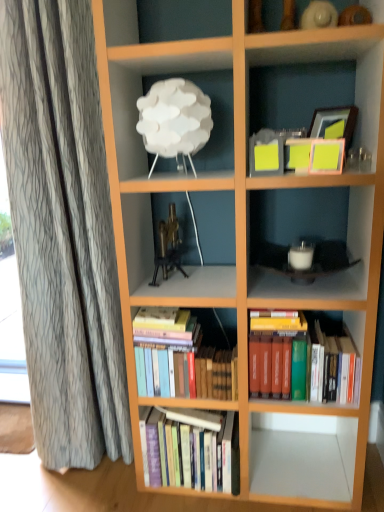
Question: Considering the relative positions of hardcover books at center, which is the third book in bottom-to-top order, and gold metallic tripod at center in the image provided, is hardcover books at center, which is the third book in bottom-to-top order, to the right of gold metallic tripod at center from the viewer's perspective?

Choices:
 (A) no
 (B) yes

Answer: (B)

Question: From a real-world perspective, is hardcover books at center, which is the third book in bottom-to-top order, physically below gold metallic tripod at center?

Choices:
 (A) yes
 (B) no

Answer: (A)

Question: Is hardcover books at center, which is the third book in bottom-to-top order, thinner than gold metallic tripod at center?

Choices:
 (A) yes
 (B) no

Answer: (B)

Question: Is hardcover books at center, which is counted as the first book, starting from the top, wider than gold metallic tripod at center?

Choices:
 (A) no
 (B) yes

Answer: (B)

Question: Is hardcover books at center, which is the third book in bottom-to-top order, taller than gold metallic tripod at center?

Choices:
 (A) no
 (B) yes

Answer: (B)

Question: Is the surface of hardcover books at center, which is the third book in bottom-to-top order, in direct contact with gold metallic tripod at center?

Choices:
 (A) yes
 (B) no

Answer: (B)

Question: Are wooden picture frame at upper right and hardcover books at center, which is the third book in bottom-to-top order, located far from each other?

Choices:
 (A) yes
 (B) no

Answer: (B)

Question: Does wooden picture frame at upper right lie behind hardcover books at center, which is counted as the first book, starting from the top?

Choices:
 (A) no
 (B) yes

Answer: (A)

Question: From the image's perspective, is wooden picture frame at upper right located beneath hardcover books at center, which is counted as the first book, starting from the top?

Choices:
 (A) yes
 (B) no

Answer: (B)

Question: Is wooden picture frame at upper right completely or partially outside of hardcover books at center, which is counted as the first book, starting from the top?

Choices:
 (A) no
 (B) yes

Answer: (B)

Question: Are wooden picture frame at upper right and hardcover books at center, which is counted as the first book, starting from the top, making contact?

Choices:
 (A) yes
 (B) no

Answer: (B)

Question: From the image's perspective, does wooden picture frame at upper right appear higher than hardcover books at center, which is the third book in bottom-to-top order?

Choices:
 (A) no
 (B) yes

Answer: (B)

Question: Could you tell me if gold metallic tripod at center is turned towards hardcover books at center, which is the second book in bottom-to-top order?

Choices:
 (A) yes
 (B) no

Answer: (B)